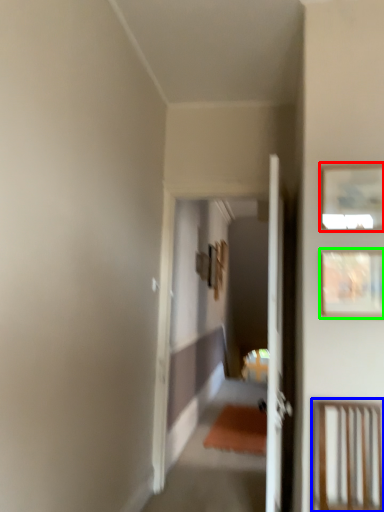
Question: Which object is the farthest from picture frame (highlighted by a red box)? Choose among these: furniture (highlighted by a blue box) or picture frame (highlighted by a green box).

Choices:
 (A) furniture
 (B) picture frame

Answer: (A)